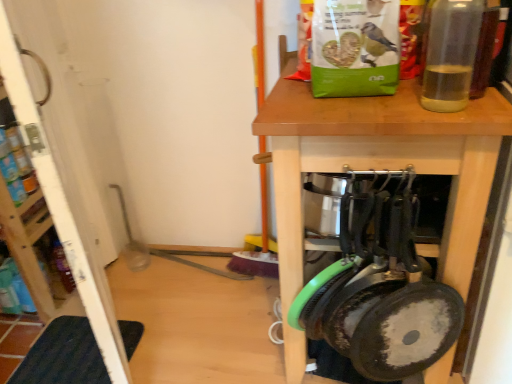
Question: From a real-world perspective, does transparent plastic bottle at upper right sit lower than wooden table at center?

Choices:
 (A) no
 (B) yes

Answer: (A)

Question: Is transparent plastic bottle at upper right positioned far away from wooden table at center?

Choices:
 (A) yes
 (B) no

Answer: (B)

Question: Is transparent plastic bottle at upper right smaller than wooden table at center?

Choices:
 (A) no
 (B) yes

Answer: (B)

Question: Considering the relative sizes of transparent plastic bottle at upper right and wooden table at center in the image provided, is transparent plastic bottle at upper right taller than wooden table at center?

Choices:
 (A) no
 (B) yes

Answer: (A)

Question: Is transparent plastic bottle at upper right in contact with wooden table at center?

Choices:
 (A) no
 (B) yes

Answer: (A)

Question: From the image's perspective, relative to transparent plastic bottle at upper right, is dark blue rubber mat at lower left above or below?

Choices:
 (A) below
 (B) above

Answer: (A)

Question: Looking at the image, does dark blue rubber mat at lower left seem bigger or smaller compared to transparent plastic bottle at upper right?

Choices:
 (A) big
 (B) small

Answer: (A)

Question: Considering the positions of point (60, 332) and point (458, 104), is point (60, 332) closer or farther from the camera than point (458, 104)?

Choices:
 (A) farther
 (B) closer

Answer: (A)

Question: Which is correct: dark blue rubber mat at lower left is inside transparent plastic bottle at upper right, or outside of it?

Choices:
 (A) inside
 (B) outside

Answer: (B)

Question: In terms of height, does white wood screen door at left look taller or shorter compared to transparent plastic bottle at upper right?

Choices:
 (A) short
 (B) tall

Answer: (B)

Question: Is point (117, 326) closer or farther from the camera than point (458, 102)?

Choices:
 (A) closer
 (B) farther

Answer: (B)

Question: Relative to transparent plastic bottle at upper right, is white wood screen door at left in front or behind?

Choices:
 (A) front
 (B) behind

Answer: (B)

Question: Considering the positions of white wood screen door at left and transparent plastic bottle at upper right in the image, is white wood screen door at left bigger or smaller than transparent plastic bottle at upper right?

Choices:
 (A) big
 (B) small

Answer: (A)

Question: From a real-world perspective, relative to wooden table at center, is transparent plastic bottle at upper right vertically above or below?

Choices:
 (A) below
 (B) above

Answer: (B)

Question: Considering their positions, is transparent plastic bottle at upper right located in front of or behind wooden table at center?

Choices:
 (A) behind
 (B) front

Answer: (B)